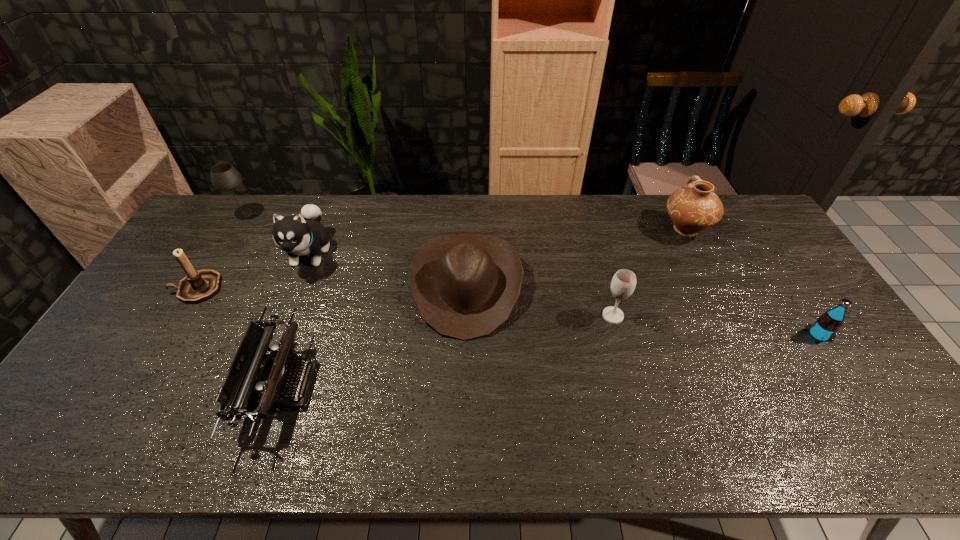
Identify which object is located as the sixth nearest to the right wineglass. Please provide its 2D coordinates. Your answer should be formatted as a tuple, i.e. [(x, y)], where the tuple contains the x and y coordinates of a point satisfying the conditions above.

[(197, 286)]

You are a GUI agent. You are given a task and a screenshot of the screen. Output one action in this format:
    pyautogui.click(x=<x>, y=<y>)
    Task: Click on the vacant area in the image that satisfies the following two spatial constraints: 1. at the face of the cowboy hat; 2. on the left side of the puppy
    This screenshot has width=960, height=540.
    Given the screenshot: What is the action you would take?
    pyautogui.click(x=298, y=286)

Locate an element on the screen. Image resolution: width=960 pixels, height=540 pixels. free point that satisfies the following two spatial constraints: 1. on the front side of the third object from right to left; 2. on the left side of the candle holder is located at coordinates (180, 316).

The width and height of the screenshot is (960, 540). I want to click on free location that satisfies the following two spatial constraints: 1. on the back side of the candle holder; 2. on the left side of the farther wineglass, so click(x=243, y=213).